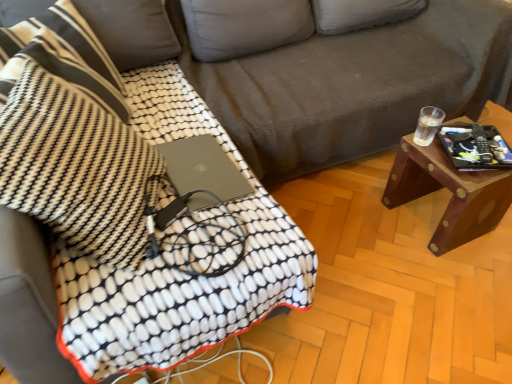
Where is `blank space above matte black laptop at center (from a real-world perspective)`? blank space above matte black laptop at center (from a real-world perspective) is located at coordinates (188, 167).